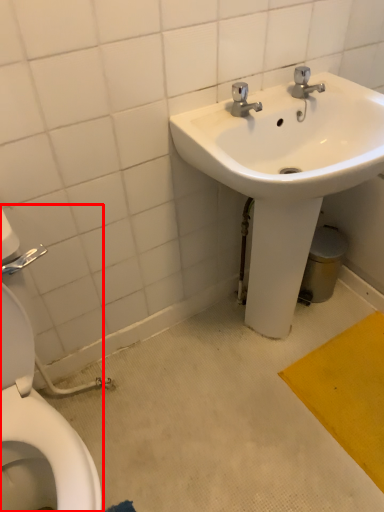
Question: Observing the image, what is the correct spatial positioning of toilet (annotated by the red box) in reference to sink?

Choices:
 (A) left
 (B) right

Answer: (A)